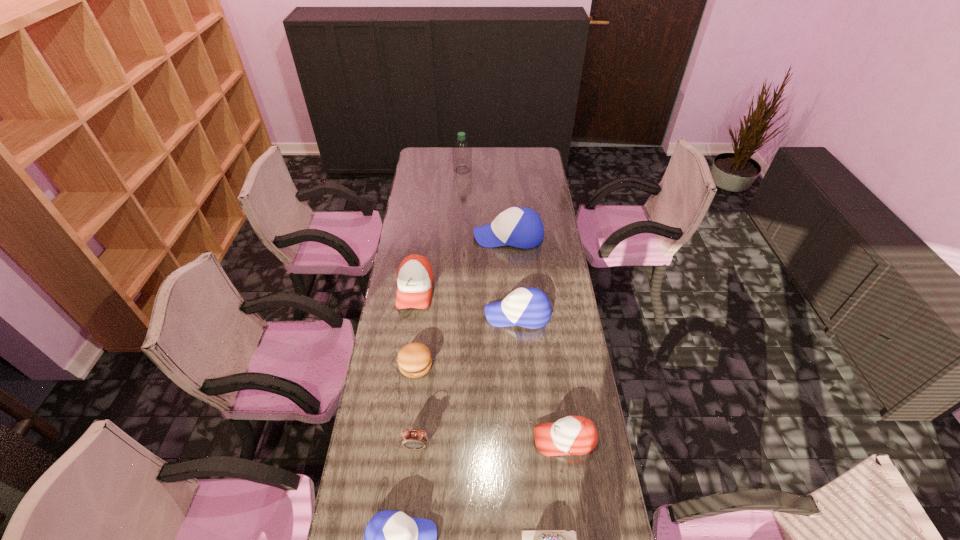
The height and width of the screenshot is (540, 960). What are the coordinates of `the fifth nearest object` in the screenshot? It's located at [414, 360].

Locate an element on the screen. This screenshot has height=540, width=960. brown hamburger is located at coordinates 414,360.

Locate an element on the screen. The image size is (960, 540). vacant space positioned 0.220m on the right of the water bottle is located at coordinates (512, 170).

Where is `free spot located on the front-facing side of the farthest white baseball cap`? The height and width of the screenshot is (540, 960). free spot located on the front-facing side of the farthest white baseball cap is located at coordinates (408, 236).

Find the location of a particular element. The height and width of the screenshot is (540, 960). free spot located 0.350m on the front-facing side of the farthest white baseball cap is located at coordinates (399, 236).

Where is `free region located 0.290m on the front-facing side of the farthest white baseball cap`? free region located 0.290m on the front-facing side of the farthest white baseball cap is located at coordinates (413, 236).

Where is `vacant position located 0.310m on the front-facing side of the bigger orange baseball cap`? Image resolution: width=960 pixels, height=540 pixels. vacant position located 0.310m on the front-facing side of the bigger orange baseball cap is located at coordinates (402, 383).

Find the location of a particular element. The image size is (960, 540). vacant space situated on the front-facing side of the second farthest white baseball cap is located at coordinates (452, 314).

Locate an element on the screen. The height and width of the screenshot is (540, 960). blank area located on the front-facing side of the second farthest white baseball cap is located at coordinates (434, 314).

The height and width of the screenshot is (540, 960). Identify the location of vacant space located on the front-facing side of the second farthest white baseball cap. (460, 314).